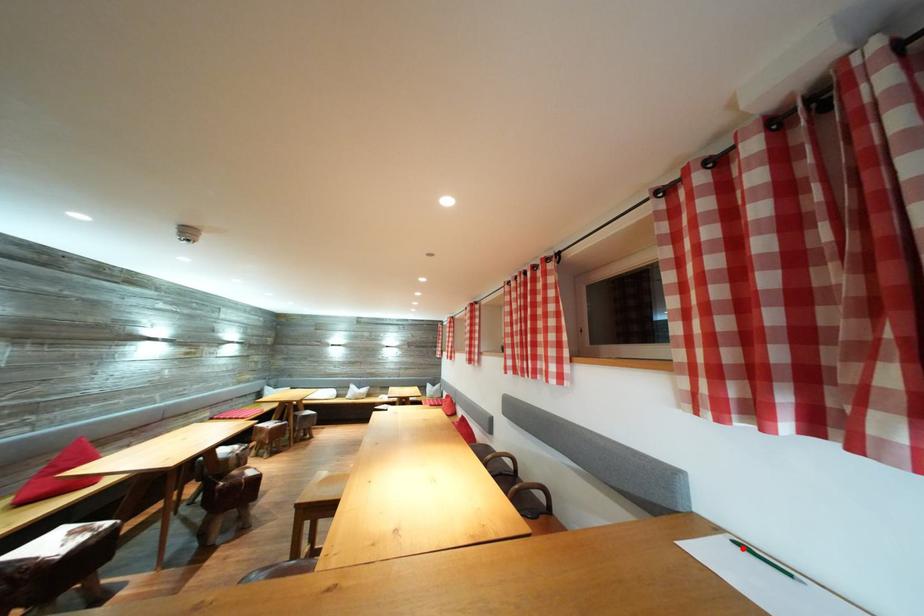
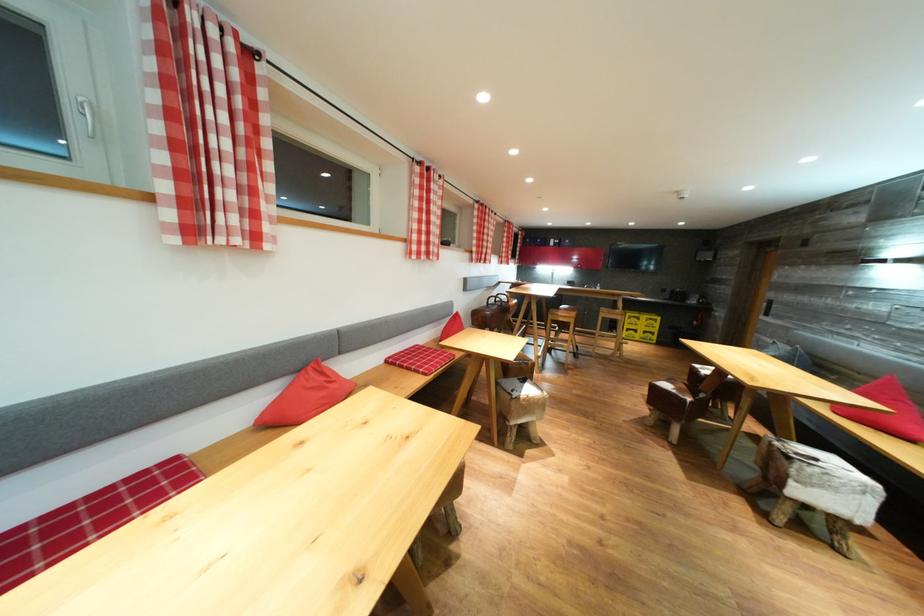
Question: I am providing you with two images of the same scene from different viewpoints. A red point is marked on the first image. At the location where the point appears in image 1, is it still visible in image 2?

Choices:
 (A) Yes
 (B) No

Answer: (B)